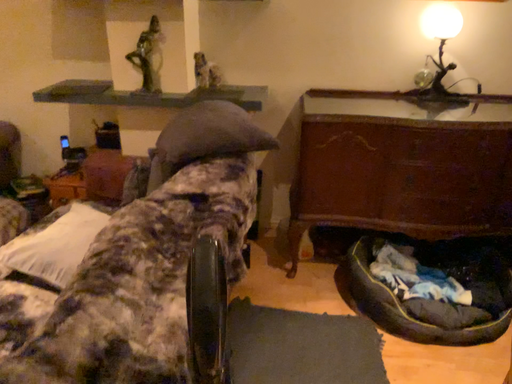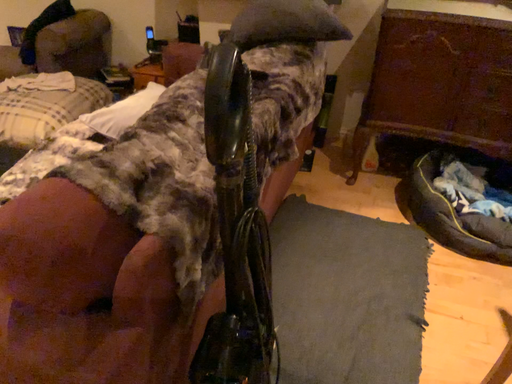
Question: Which way did the camera rotate in the video?

Choices:
 (A) rotated downward
 (B) rotated upward

Answer: (A)